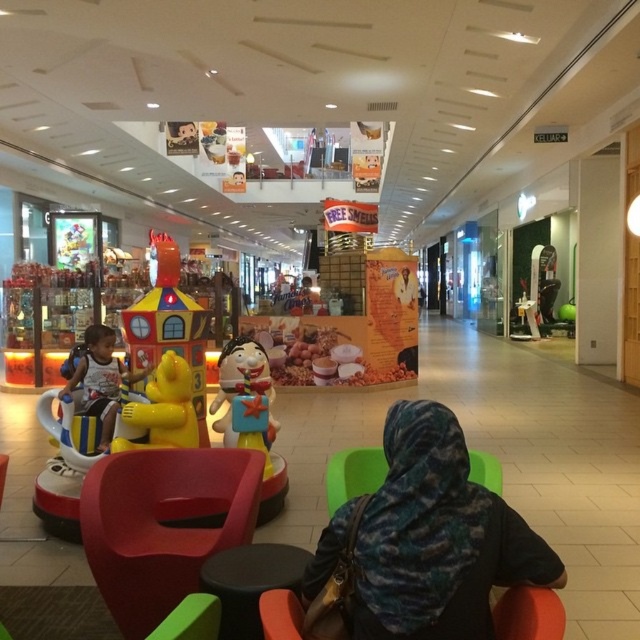
Is orange fabric armchair at lower center bigger than yellow matte bear at center?

Actually, orange fabric armchair at lower center might be smaller than yellow matte bear at center.

Is point (269, 609) behind point (166, 378)?

That is False.

This screenshot has height=640, width=640. What are the coordinates of `orange fabric armchair at lower center` in the screenshot? It's located at (529, 612).

Is the position of matte black helmet at left less distant than that of camouflage fabric armchair at center?

No, it is behind camouflage fabric armchair at center.

Between matte black helmet at left and camouflage fabric armchair at center, which one appears on the right side from the viewer's perspective?

camouflage fabric armchair at center is more to the right.

Identify the location of matte black helmet at left. This screenshot has width=640, height=640. (100, 380).

Identify the location of matte black helmet at left. (100, 380).

Between camouflage fabric headscarf at center and matte black helmet at left, which one is positioned lower?

camouflage fabric headscarf at center is below.

Who is higher up, camouflage fabric headscarf at center or matte black helmet at left?

matte black helmet at left

Between point (426, 598) and point (61, 390), which one is positioned behind?

Point (61, 390)

Locate an element on the screen. The width and height of the screenshot is (640, 640). camouflage fabric headscarf at center is located at coordinates (436, 538).